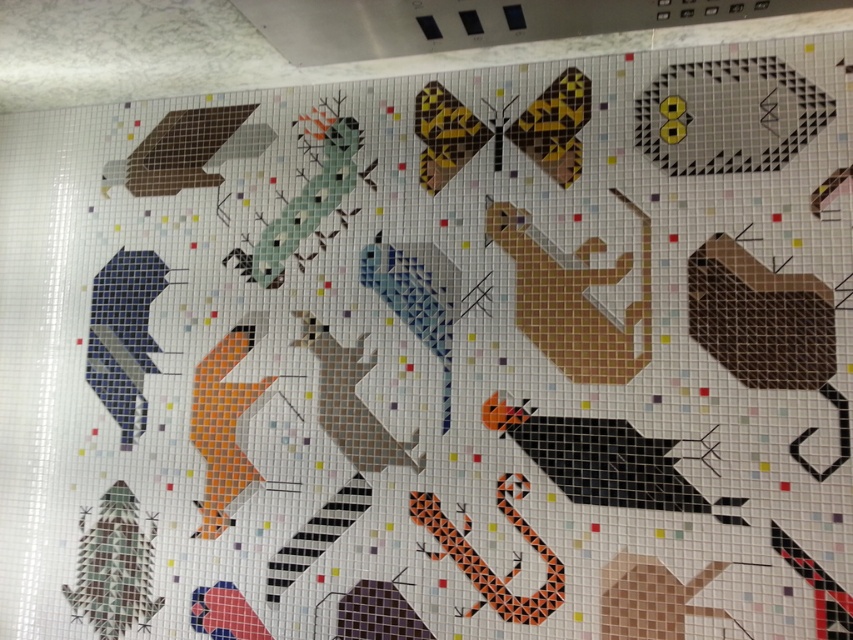
Does point (712, 74) lie behind point (585, 294)?

No, (712, 74) is closer to viewer.

Can you confirm if yellow dotted square at upper right is bigger than matte beige bird at center?

No.

Is point (770, 80) farther from viewer compared to point (576, 365)?

No, it is in front of (576, 365).

This screenshot has width=853, height=640. I want to click on yellow dotted square at upper right, so click(728, 115).

Is yellow dotted square at upper right thinner than brown matte exhaust hood at upper left?

In fact, yellow dotted square at upper right might be wider than brown matte exhaust hood at upper left.

Locate an element on the screen. yellow dotted square at upper right is located at coordinates (728, 115).

Is matte beige bird at center smaller than brown matte exhaust hood at upper left?

No, matte beige bird at center is not smaller than brown matte exhaust hood at upper left.

Is point (587, 276) positioned behind point (135, 195)?

No, it is in front of (135, 195).

From the picture: Who is more distant from viewer, (593, 280) or (207, 115)?

Positioned behind is point (207, 115).

The image size is (853, 640). I want to click on matte beige bird at center, so click(573, 298).